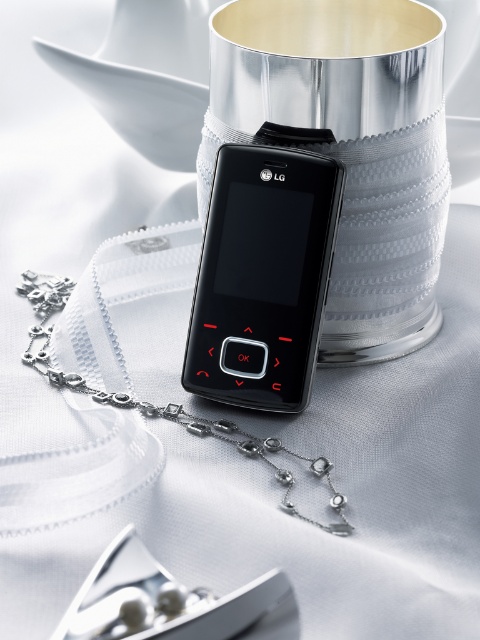
Question: Does black matte lg phone at center appear under silver metallic chain at center?

Choices:
 (A) yes
 (B) no

Answer: (B)

Question: Which point is farther to the camera?

Choices:
 (A) (71, 385)
 (B) (231, 154)

Answer: (A)

Question: Can you confirm if black matte lg phone at center is wider than silver metallic chain at center?

Choices:
 (A) no
 (B) yes

Answer: (A)

Question: Does black matte lg phone at center have a lesser width compared to silver metallic chain at center?

Choices:
 (A) no
 (B) yes

Answer: (B)